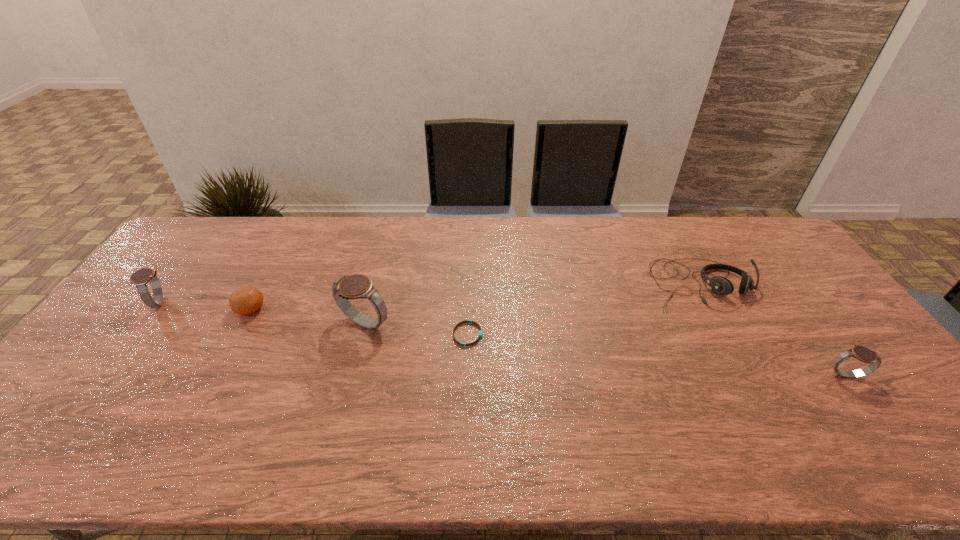
Please point a location where one more watch can be added evenly. Please provide its 2D coordinates. Your answer should be formatted as a tuple, i.e. [(x, y)], where the tuple contains the x and y coordinates of a point satisfying the conditions above.

[(592, 348)]